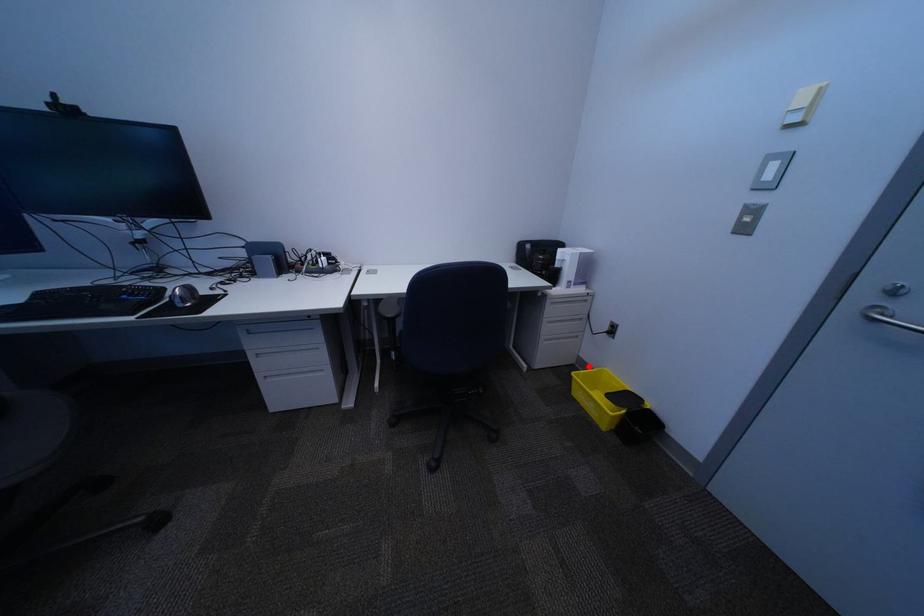
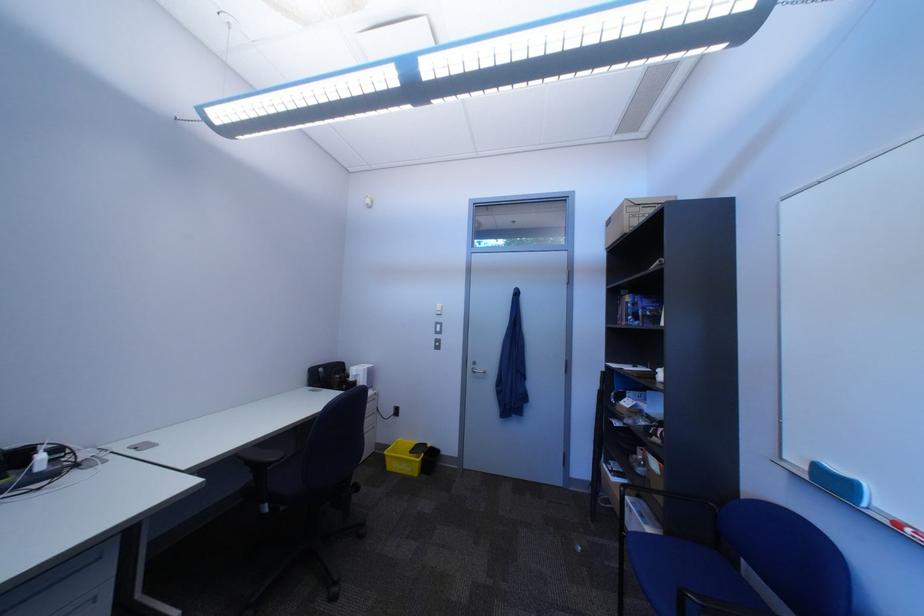
Question: I am providing you with two images of the same scene from different viewpoints. A red point is shown in image1. For the corresponding object point in image2, is it positioned nearer or farther from the camera?

Choices:
 (A) Nearer
 (B) Farther

Answer: (B)